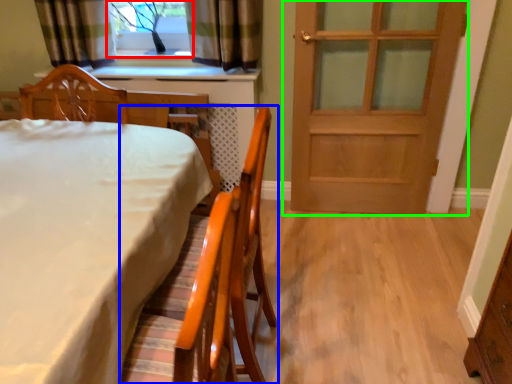
Question: Which object is the closest to the window (highlighted by a red box)? Choose among these: chair (highlighted by a blue box) or door (highlighted by a green box).

Choices:
 (A) chair
 (B) door

Answer: (B)